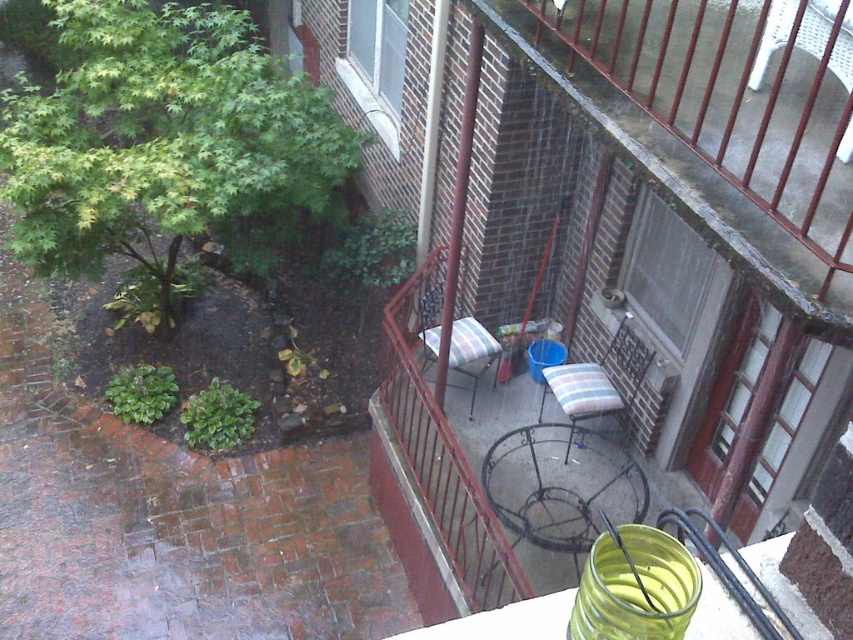
Between green leafy tree at left and striped fabric chair at center, which one appears on the right side from the viewer's perspective?

striped fabric chair at center is more to the right.

I want to click on green leafy tree at left, so click(x=164, y=141).

Who is more distant from viewer, [22,164] or [466,339]?

The point [466,339] is more distant.

Where is `green leafy tree at left`? Image resolution: width=853 pixels, height=640 pixels. green leafy tree at left is located at coordinates (164, 141).

Can you confirm if green leafy tree at left is wider than striped fabric cushion at lower right?

Indeed, green leafy tree at left has a greater width compared to striped fabric cushion at lower right.

Image resolution: width=853 pixels, height=640 pixels. Find the location of `green leafy tree at left`. green leafy tree at left is located at coordinates (164, 141).

Is striped fabric chairs at center positioned behind striped fabric cushion at lower right?

No, striped fabric chairs at center is in front of striped fabric cushion at lower right.

Based on the photo, does striped fabric chairs at center have a lesser height compared to striped fabric cushion at lower right?

No, striped fabric chairs at center is not shorter than striped fabric cushion at lower right.

Is point (780, 342) behind point (550, 390)?

No, it is not.

At what (x,y) coordinates should I click in order to perform the action: click on striped fabric chairs at center. Please return your answer as a coordinate pair (x, y). Looking at the image, I should click on (764, 292).